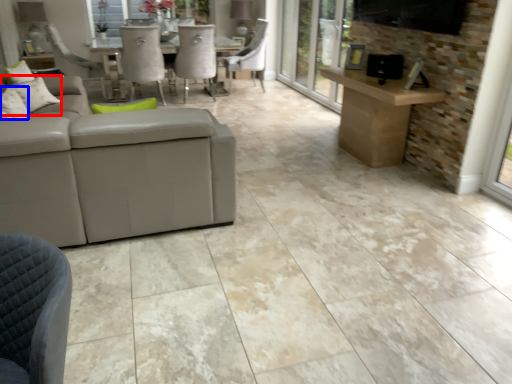
Question: Which object is closer to the camera taking this photo, pillow (highlighted by a red box) or pillow (highlighted by a blue box)?

Choices:
 (A) pillow
 (B) pillow

Answer: (B)